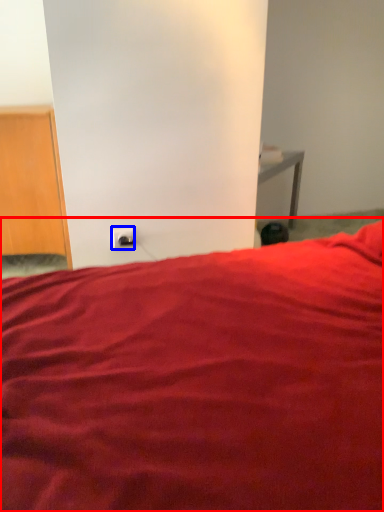
Question: Which point is further to the camera, bed (highlighted by a red box) or electric outlet (highlighted by a blue box)?

Choices:
 (A) bed
 (B) electric outlet

Answer: (B)